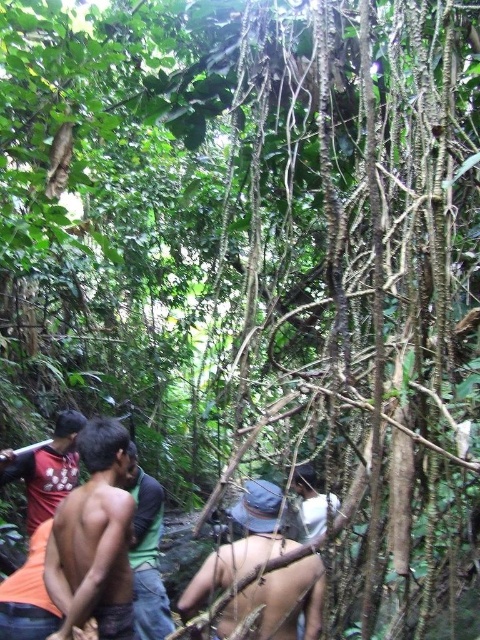
Question: Does matte red shirt at left have a greater width compared to white matte shirt at center?

Choices:
 (A) no
 (B) yes

Answer: (B)

Question: Which point is farther to the camera?

Choices:
 (A) (108, 433)
 (B) (134, 513)
 (C) (310, 522)
 (D) (50, 515)

Answer: (C)

Question: Among these points, which one is nearest to the camera?

Choices:
 (A) (312, 492)
 (B) (140, 586)
 (C) (13, 476)
 (D) (240, 524)

Answer: (D)

Question: Is blue fabric hat at center smaller than white matte shirt at center?

Choices:
 (A) yes
 (B) no

Answer: (A)

Question: Can you confirm if blue fabric hat at center is bigger than green shirt at center?

Choices:
 (A) yes
 (B) no

Answer: (B)

Question: Which point is farther to the camera?

Choices:
 (A) (311, 512)
 (B) (153, 572)
 (C) (260, 556)

Answer: (A)